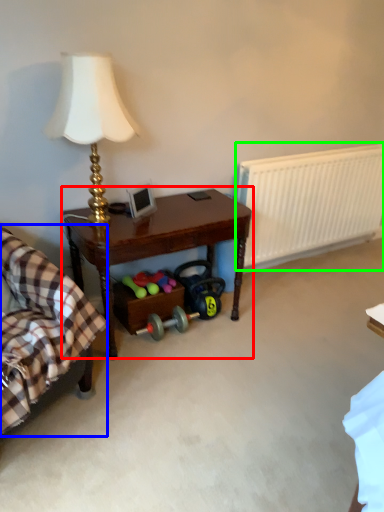
Question: Which is nearer to the table (highlighted by a red box)? rocking chair (highlighted by a blue box) or radiator (highlighted by a green box).

Choices:
 (A) rocking chair
 (B) radiator

Answer: (A)